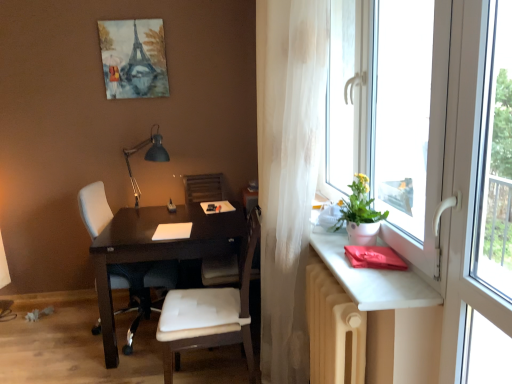
Locate an element on the screen. The height and width of the screenshot is (384, 512). vacant position to the left of white matte pot at window is located at coordinates (323, 246).